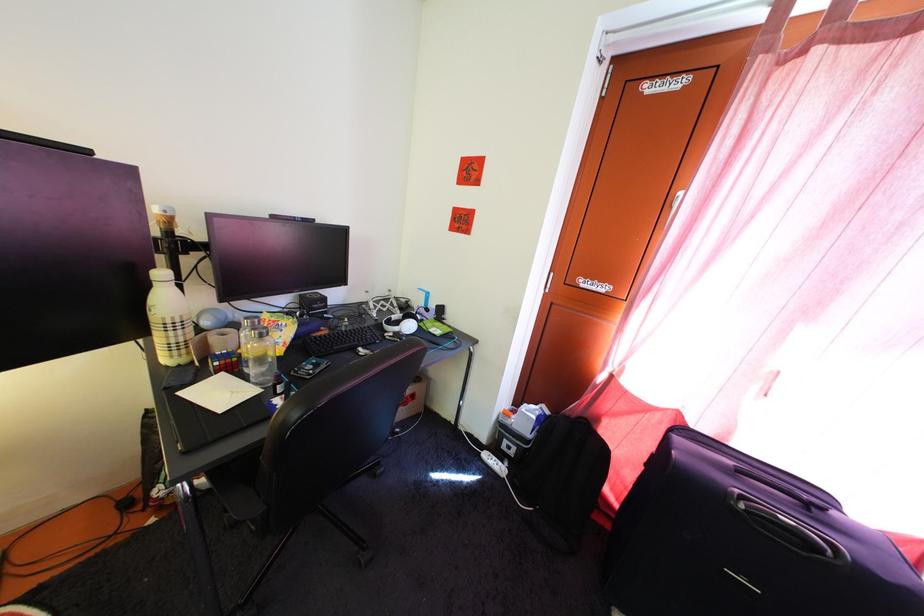
Locate an element on the screen. roll of tape is located at coordinates (223, 339).